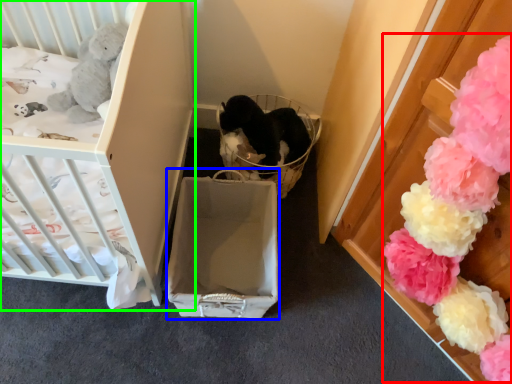
Question: Considering the real-world distances, which object is closest to flower (highlighted by a red box)? cardboard box (highlighted by a blue box) or infant bed (highlighted by a green box).

Choices:
 (A) cardboard box
 (B) infant bed

Answer: (A)